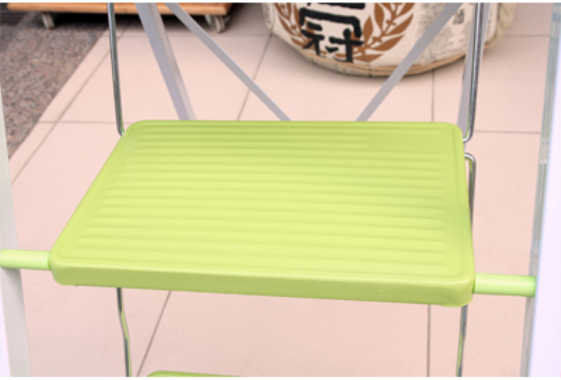
Locate an element on the screen. grey carpet is located at coordinates (59, 53).